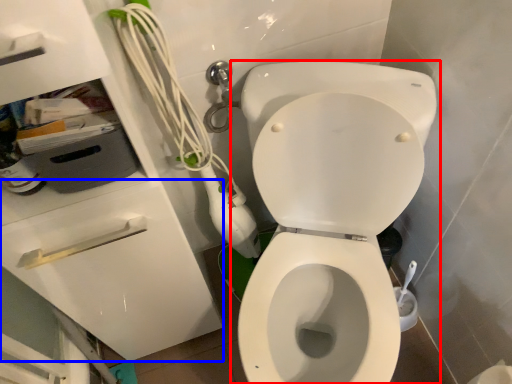
Question: Which of the following is the farthest to the observer, toilet (highlighted by a red box) or drawer (highlighted by a blue box)?

Choices:
 (A) toilet
 (B) drawer

Answer: (B)